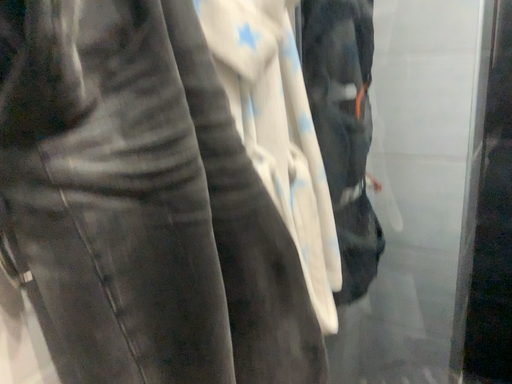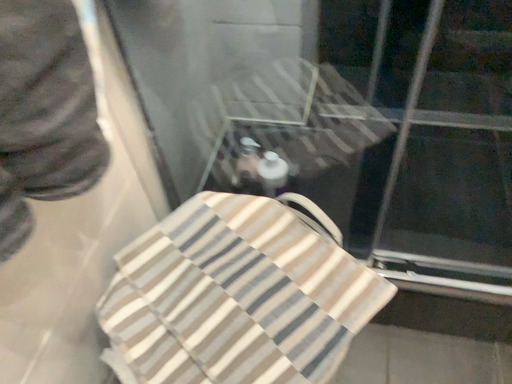
Question: How did the camera likely rotate when shooting the video?

Choices:
 (A) rotated right
 (B) rotated left

Answer: (A)